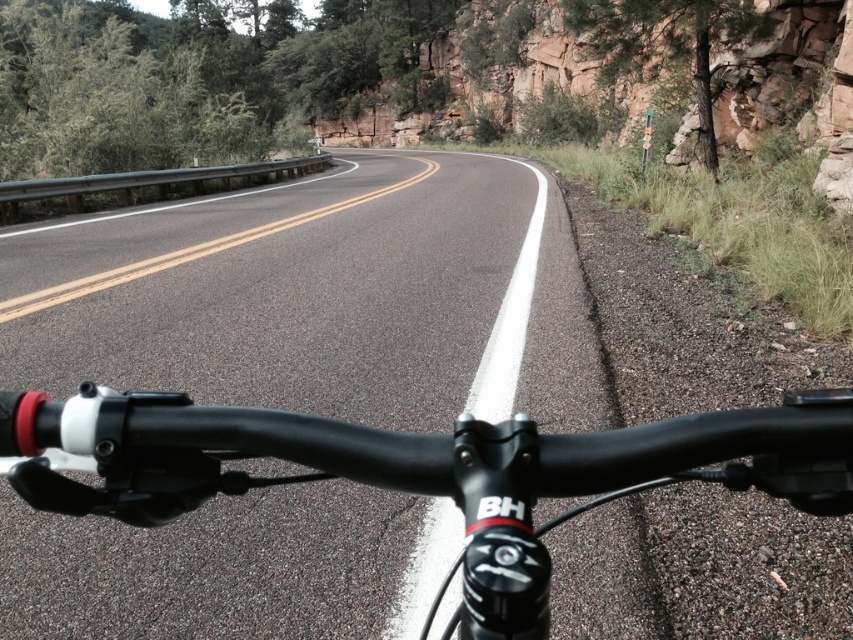
You are a cyclist looking at the road ahead. Which object, the black asphalt road at center or the black matte bicycle handlebars at center, takes up more space in your view?

The black asphalt road at center has a larger size compared to the black matte bicycle handlebars at center, so the black asphalt road at center takes up more space in your view.